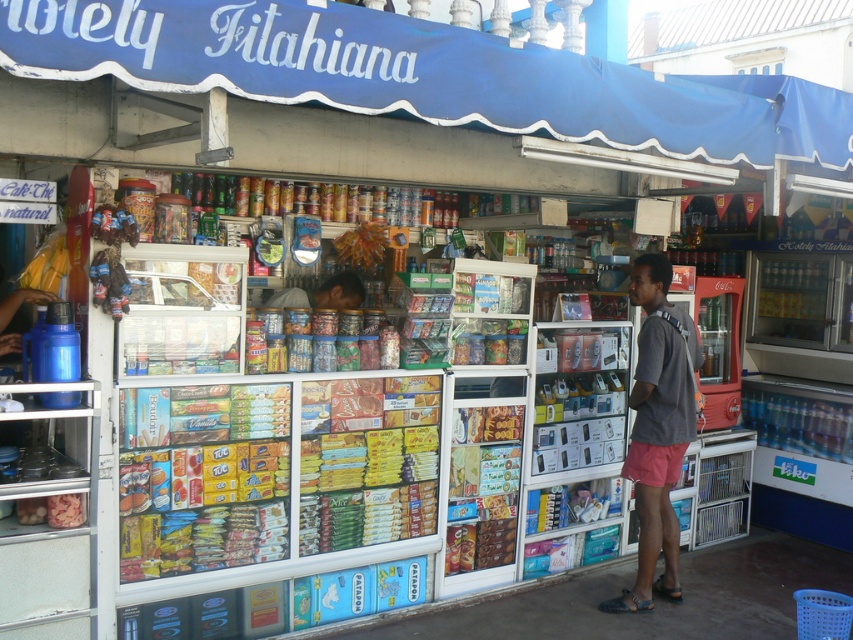
Question: Where is gray fabric shirt at center located in relation to matte brown bag at center in the image?

Choices:
 (A) left
 (B) right

Answer: (B)

Question: Among these objects, which one is farthest from the camera?

Choices:
 (A) matte brown bag at center
 (B) gray fabric shirt at center

Answer: (B)

Question: Among these objects, which one is farthest from the camera?

Choices:
 (A) gray fabric shirt at center
 (B) matte brown bag at center

Answer: (A)

Question: Is gray fabric shirt at center smaller than matte brown bag at center?

Choices:
 (A) yes
 (B) no

Answer: (B)

Question: Which of the following is the farthest from the observer?

Choices:
 (A) (x=659, y=440)
 (B) (x=318, y=298)

Answer: (B)

Question: Can you confirm if gray fabric shirt at center is positioned to the left of matte brown bag at center?

Choices:
 (A) yes
 (B) no

Answer: (B)